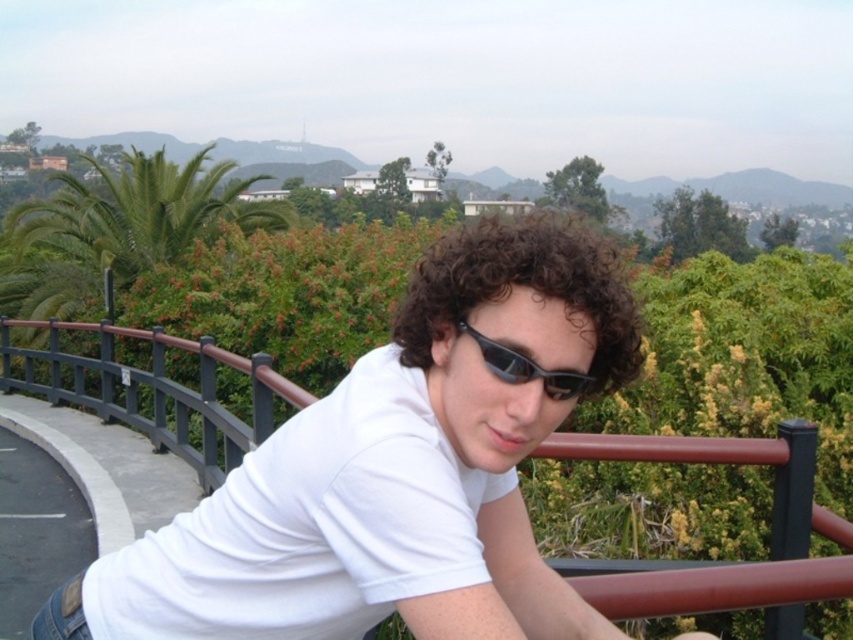
Question: Can you confirm if white matte shirt at center is thinner than curly brown hair at center?

Choices:
 (A) no
 (B) yes

Answer: (A)

Question: Is white matte shirt at center positioned before curly brown hair at center?

Choices:
 (A) no
 (B) yes

Answer: (B)

Question: Which object appears closest to the camera in this image?

Choices:
 (A) black plastic goggles at center
 (B) white matte shirt at center
 (C) curly brown hair at center

Answer: (B)

Question: Is curly brown hair at center below black plastic goggles at center?

Choices:
 (A) no
 (B) yes

Answer: (A)

Question: Which is nearer to the white matte shirt at center?

Choices:
 (A) curly brown hair at center
 (B) black plastic goggles at center

Answer: (B)

Question: Which of the following is the farthest from the observer?

Choices:
 (A) (494, 394)
 (B) (581, 380)
 (C) (598, 358)

Answer: (C)